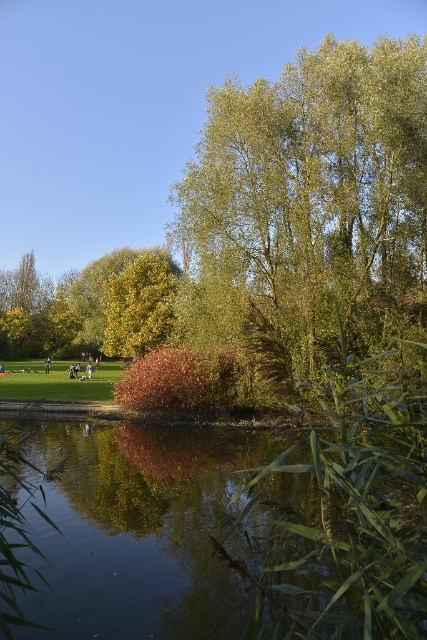
Who is shorter, green reflective water at center or yellow-green foliage at center?

With less height is green reflective water at center.

Which is behind, point (145, 440) or point (140, 346)?

The point (140, 346) is more distant.

Is point (199, 467) positioned before point (154, 326)?

Yes, it is.

Find the location of a particular element. Image resolution: width=427 pixels, height=640 pixels. green reflective water at center is located at coordinates (155, 529).

Does light brown wooden bench at center appear under light brown leather jacket at center?

Incorrect, light brown wooden bench at center is not positioned below light brown leather jacket at center.

Is point (85, 371) positioned in front of point (46, 369)?

Yes.

Between point (90, 376) and point (49, 356), which one is positioned in front?

Positioned in front is point (90, 376).

Identify the location of light brown wooden bench at center. Image resolution: width=427 pixels, height=640 pixels. (88, 369).

Does point (403, 140) come in front of point (269, 545)?

No, it is not.

Does green leafy tree at center have a lesser height compared to green reflective water at center?

Incorrect, green leafy tree at center's height does not fall short of green reflective water at center's.

Who is more distant from viewer, (x=363, y=244) or (x=175, y=451)?

The point (x=363, y=244) is more distant.

I want to click on green leafy tree at center, so click(310, 209).